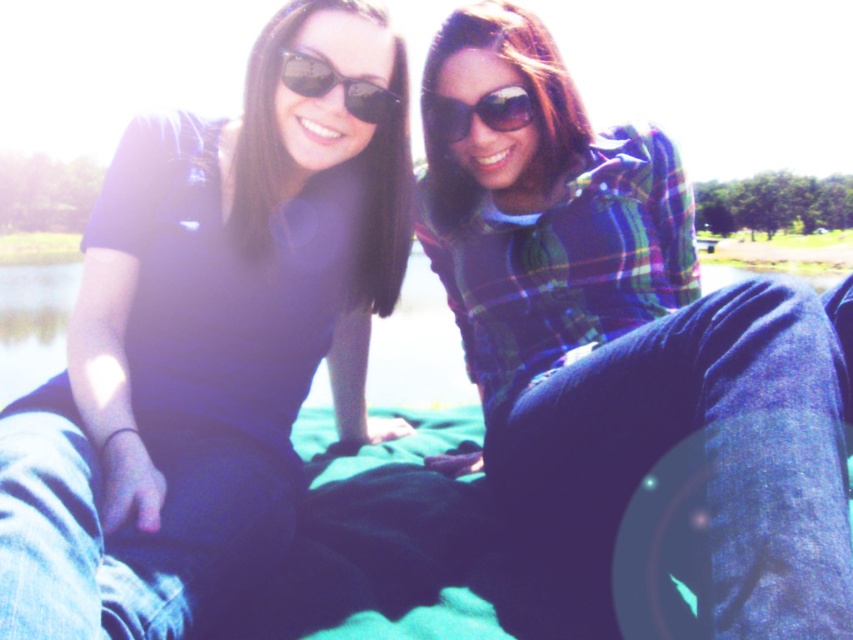
Question: Which point appears farthest from the camera in this image?

Choices:
 (A) (357, 253)
 (B) (351, 109)
 (C) (532, 120)

Answer: (A)

Question: Based on their relative distances, which object is nearer to the plaid flannel shirt at center?

Choices:
 (A) matte black sunglasses at upper center
 (B) black reflective sunglasses at upper center
 (C) green grass at lower left

Answer: (A)

Question: Does matte black shirt at center appear on the left side of matte black sunglasses at upper center?

Choices:
 (A) no
 (B) yes

Answer: (B)

Question: Which point appears farthest from the camera in this image?

Choices:
 (A) (674, 385)
 (B) (531, 115)
 (C) (190, 500)
 (D) (345, 104)

Answer: (B)

Question: Is black reflective sunglasses at upper center bigger than matte black sunglasses at upper center?

Choices:
 (A) no
 (B) yes

Answer: (B)

Question: Is matte black shirt at center below plaid flannel shirt at center?

Choices:
 (A) yes
 (B) no

Answer: (B)